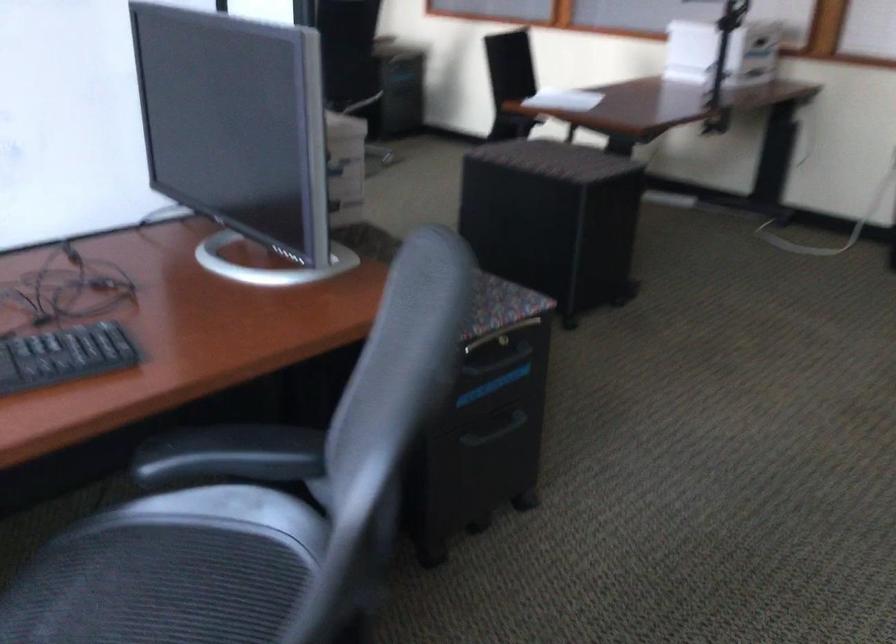
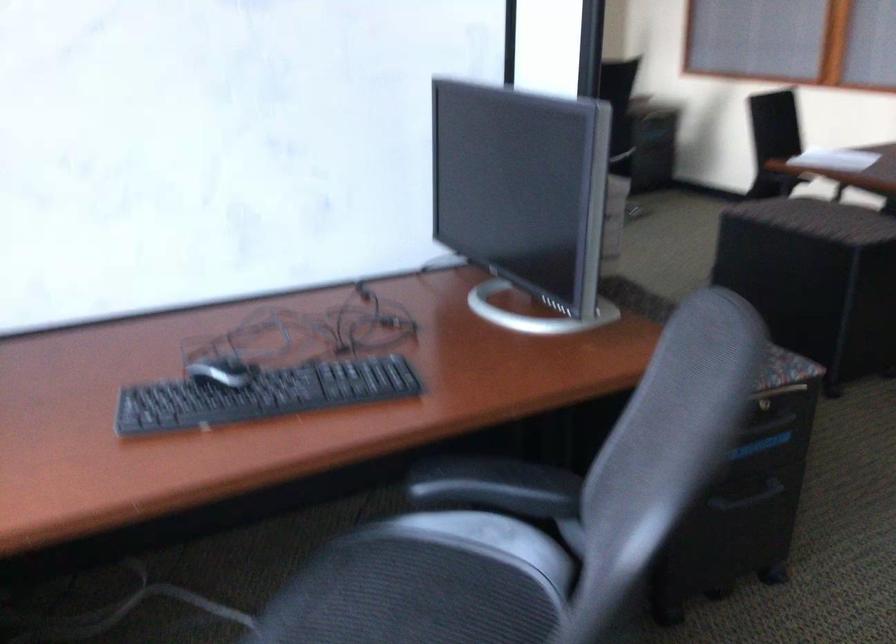
Question: The camera is either moving clockwise (left) or counter-clockwise (right) around the object. The first image is from the beginning of the video and the second image is from the end. Is the camera moving left or right when shooting the video?

Choices:
 (A) Left
 (B) Right

Answer: (B)